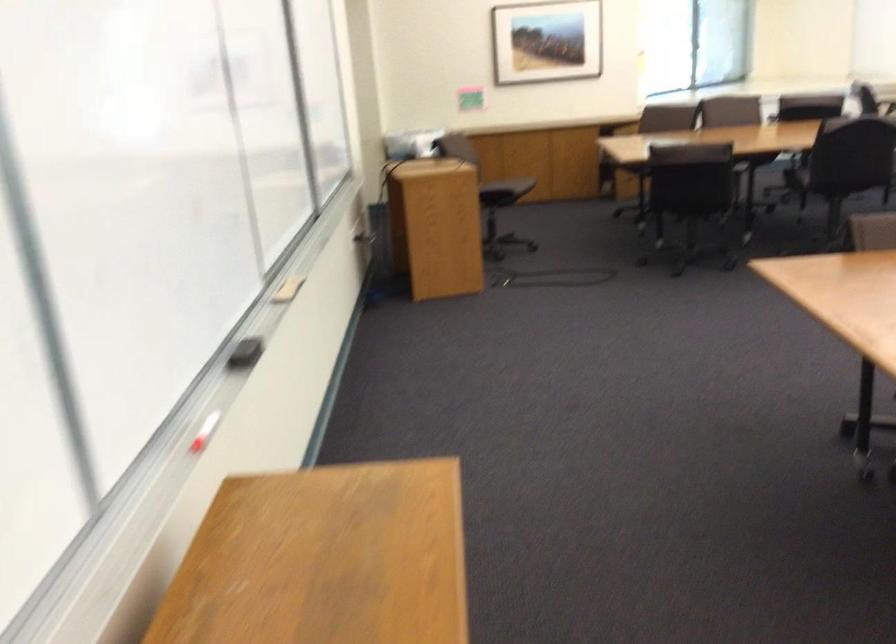
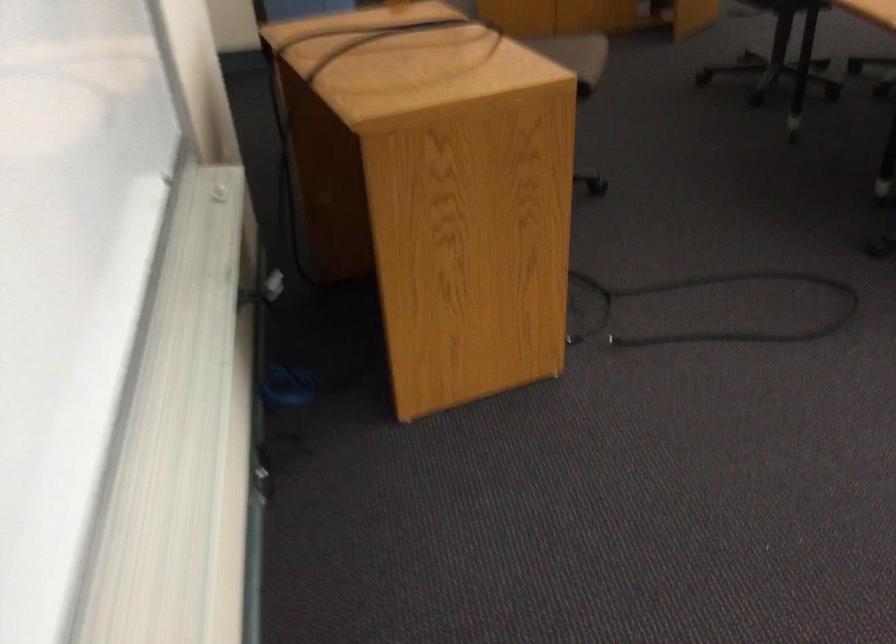
Where in the second image is the point corresponding to the point at 562,272 from the first image?

(712, 308)